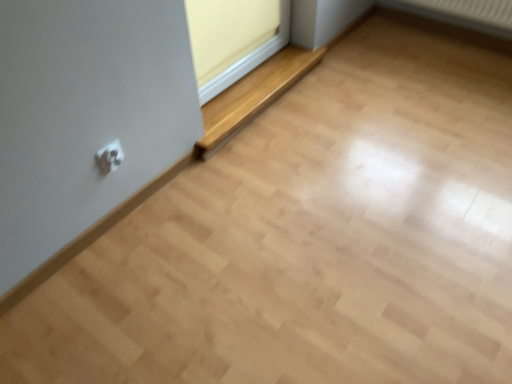
Question: Is the position of white plastic electric outlet at lower left less distant than that of wooden at lower center?

Choices:
 (A) no
 (B) yes

Answer: (B)

Question: Is white plastic electric outlet at lower left not close to wooden at lower center?

Choices:
 (A) yes
 (B) no

Answer: (B)

Question: Considering the relative sizes of white plastic electric outlet at lower left and wooden at lower center in the image provided, is white plastic electric outlet at lower left shorter than wooden at lower center?

Choices:
 (A) yes
 (B) no

Answer: (A)

Question: From the image's perspective, is white plastic electric outlet at lower left located above wooden at lower center?

Choices:
 (A) yes
 (B) no

Answer: (B)

Question: Is white plastic electric outlet at lower left to the right of wooden at lower center from the viewer's perspective?

Choices:
 (A) yes
 (B) no

Answer: (B)

Question: From a real-world perspective, is white plastic electric outlet at lower left beneath wooden at lower center?

Choices:
 (A) no
 (B) yes

Answer: (A)

Question: From a real-world perspective, is wooden at lower center positioned over matte yellow window frame at upper center based on gravity?

Choices:
 (A) no
 (B) yes

Answer: (A)

Question: Is wooden at lower center further to camera compared to matte yellow window frame at upper center?

Choices:
 (A) no
 (B) yes

Answer: (B)

Question: Is wooden at lower center surrounding matte yellow window frame at upper center?

Choices:
 (A) no
 (B) yes

Answer: (A)

Question: Can you confirm if wooden at lower center is thinner than matte yellow window frame at upper center?

Choices:
 (A) yes
 (B) no

Answer: (B)

Question: Can you confirm if wooden at lower center is smaller than matte yellow window frame at upper center?

Choices:
 (A) no
 (B) yes

Answer: (A)

Question: Considering the relative positions of wooden at lower center and matte yellow window frame at upper center in the image provided, is wooden at lower center to the left of matte yellow window frame at upper center from the viewer's perspective?

Choices:
 (A) yes
 (B) no

Answer: (B)

Question: Is matte yellow window frame at upper center taller than white plastic electric outlet at lower left?

Choices:
 (A) yes
 (B) no

Answer: (A)